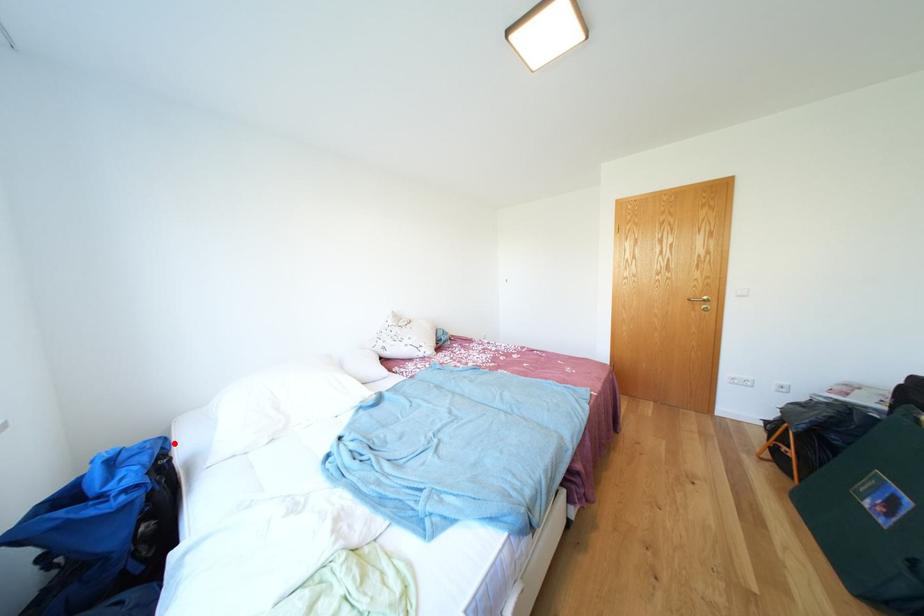
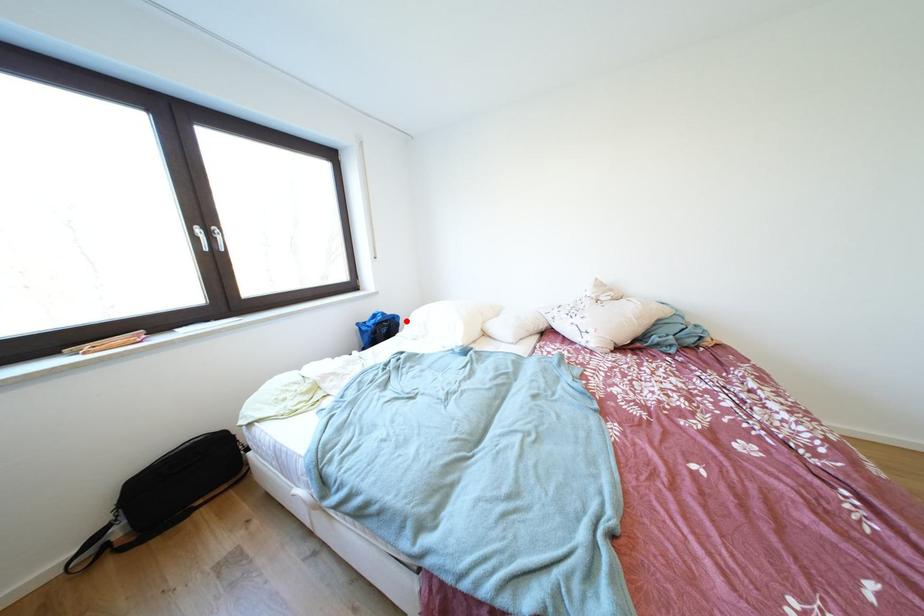
I am providing you with two images of the same scene from different viewpoints. A red point is marked on the first image and another point is marked on the second image. Are the points marked in image1 and image2 representing the same 3D position?

Yes